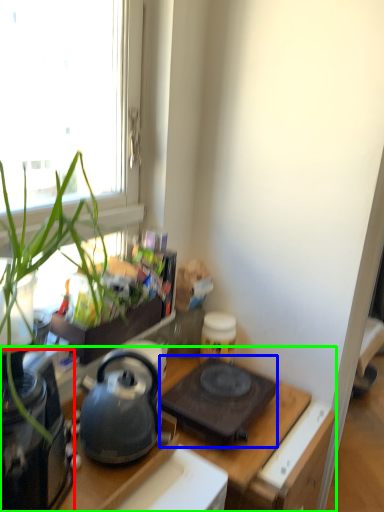
Question: Which object is the farthest from appliance (highlighted by a red box)? Choose among these: gas stove (highlighted by a blue box) or desk (highlighted by a green box).

Choices:
 (A) gas stove
 (B) desk

Answer: (A)